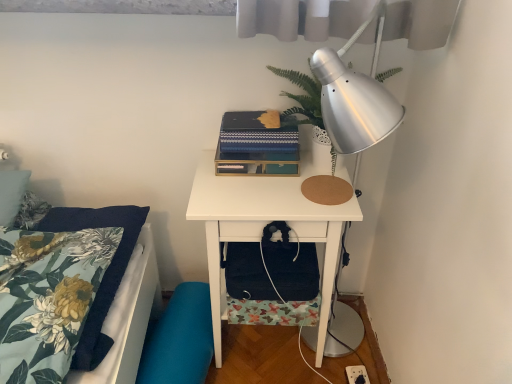
What do you see at coordinates (357, 374) in the screenshot?
I see `white plastic electric outlet at lower right` at bounding box center [357, 374].

Where is `blue textured book at center`? The height and width of the screenshot is (384, 512). blue textured book at center is located at coordinates (256, 133).

Image resolution: width=512 pixels, height=384 pixels. What do you see at coordinates (179, 339) in the screenshot?
I see `teal fabric swivel chair at lower left` at bounding box center [179, 339].

Identify the location of floral fabric pillow at left. The height and width of the screenshot is (384, 512). (117, 323).

Does teal fabric swivel chair at lower left lie in front of black fabric bag at lower center?

No, it is behind black fabric bag at lower center.

Is teal fabric swivel chair at lower left bigger or smaller than black fabric bag at lower center?

Clearly, teal fabric swivel chair at lower left is larger in size than black fabric bag at lower center.

The height and width of the screenshot is (384, 512). I want to click on footrest located on the right of teal fabric swivel chair at lower left, so click(x=293, y=270).

Measure the distance from green leafy plant at upper right to teal fabric swivel chair at lower left.

green leafy plant at upper right and teal fabric swivel chair at lower left are 90.93 centimeters apart from each other.

Considering the sizes of green leafy plant at upper right and teal fabric swivel chair at lower left in the image, is green leafy plant at upper right taller or shorter than teal fabric swivel chair at lower left?

In the image, green leafy plant at upper right appears to be taller than teal fabric swivel chair at lower left.

In the scene shown: From a real-world perspective, which object stands above the other?

green leafy plant at upper right is physically above.

Which is more to the right, green leafy plant at upper right or teal fabric swivel chair at lower left?

From the viewer's perspective, green leafy plant at upper right appears more on the right side.

Is teal fabric swivel chair at lower left far from white matte nightstand at center?

No, teal fabric swivel chair at lower left is in close proximity to white matte nightstand at center.

From the image's perspective, between teal fabric swivel chair at lower left and white matte nightstand at center, which one is located above?

white matte nightstand at center, from the image's perspective.

Does teal fabric swivel chair at lower left contain white matte nightstand at center?

That's incorrect, white matte nightstand at center is not inside teal fabric swivel chair at lower left.

Considering the relative sizes of teal fabric swivel chair at lower left and white matte nightstand at center in the image provided, is teal fabric swivel chair at lower left taller than white matte nightstand at center?

Incorrect, the height of teal fabric swivel chair at lower left is not larger of that of white matte nightstand at center.

From a real-world perspective, which is physically above, blue textured book at center or black fabric bag at lower center?

From a 3D spatial view, blue textured book at center is above.

Does blue textured book at center turn towards black fabric bag at lower center?

No, blue textured book at center is not turned towards black fabric bag at lower center.

Which object is closer to the camera taking this photo, blue textured book at center or black fabric bag at lower center?

black fabric bag at lower center is closer to the camera.

Consider the image. Is blue textured book at center bigger than black fabric bag at lower center?

Actually, blue textured book at center might be smaller than black fabric bag at lower center.

From a real-world perspective, is teal fabric swivel chair at lower left positioned under green leafy plant at upper right based on gravity?

Correct, in the physical world, teal fabric swivel chair at lower left is lower than green leafy plant at upper right.

Consider the image. Considering the relative positions of teal fabric swivel chair at lower left and green leafy plant at upper right in the image provided, is teal fabric swivel chair at lower left to the left or to the right of green leafy plant at upper right?

In the image, teal fabric swivel chair at lower left appears on the left side of green leafy plant at upper right.

In terms of height, does teal fabric swivel chair at lower left look taller or shorter compared to green leafy plant at upper right?

Clearly, teal fabric swivel chair at lower left is shorter compared to green leafy plant at upper right.

Can you tell me how much teal fabric swivel chair at lower left and green leafy plant at upper right differ in facing direction?

The facing directions of teal fabric swivel chair at lower left and green leafy plant at upper right are 83.4 degrees apart.

Considering the sizes of objects teal fabric swivel chair at lower left and blue textured book at center in the image provided, who is taller, teal fabric swivel chair at lower left or blue textured book at center?

Standing taller between the two is teal fabric swivel chair at lower left.

Is teal fabric swivel chair at lower left positioned beyond the bounds of blue textured book at center?

Absolutely, teal fabric swivel chair at lower left is external to blue textured book at center.

Is teal fabric swivel chair at lower left facing away from blue textured book at center?

No, teal fabric swivel chair at lower left is not facing the opposite direction of blue textured book at center.

Measure the distance between teal fabric swivel chair at lower left and blue textured book at center.

teal fabric swivel chair at lower left is 25.45 inches from blue textured book at center.

Is white plastic electric outlet at lower right in front of teal fabric swivel chair at lower left?

No.

From the image's perspective, relative to teal fabric swivel chair at lower left, is white plastic electric outlet at lower right above or below?

From the image's perspective, white plastic electric outlet at lower right appears below teal fabric swivel chair at lower left.

From the picture: Is teal fabric swivel chair at lower left a part of white plastic electric outlet at lower right?

Actually, teal fabric swivel chair at lower left is outside white plastic electric outlet at lower right.

At what (x,y) coordinates should I click in order to perform the action: click on the footrest above the teal fabric swivel chair at lower left (from a real-world perspective). Please return your answer as a coordinate pair (x, y). Looking at the image, I should click on (293, 270).

Locate an element on the screen. swivel chair below the green leafy plant at upper right (from a real-world perspective) is located at coordinates (179, 339).

Looking at the image, which one is located closer to floral fabric pillow at left, black fabric bag at lower center or white matte nightstand at center?

white matte nightstand at center lies closer to floral fabric pillow at left than the other object.

Based on their spatial positions, is blue textured book at center or floral fabric pillow at left further from green leafy plant at upper right?

floral fabric pillow at left is further to green leafy plant at upper right.

Considering their positions, is floral fabric pillow at left positioned further to black fabric bag at lower center than teal fabric swivel chair at lower left?

Based on the image, floral fabric pillow at left appears to be further to black fabric bag at lower center.

From the picture: Estimate the real-world distances between objects in this image. Which object is further from blue textured book at center, white plastic electric outlet at lower right or black fabric bag at lower center?

white plastic electric outlet at lower right.

Consider the image. Based on their spatial positions, is black fabric bag at lower center or green leafy plant at upper right closer to teal fabric swivel chair at lower left?

Among the two, black fabric bag at lower center is located nearer to teal fabric swivel chair at lower left.

Which object lies further to the anchor point black fabric bag at lower center, blue textured book at center or white matte nightstand at center?

blue textured book at center lies further to black fabric bag at lower center than the other object.

Estimate the real-world distances between objects in this image. Which object is closer to blue textured book at center, white plastic electric outlet at lower right or teal fabric swivel chair at lower left?

teal fabric swivel chair at lower left is closer to blue textured book at center.

When comparing their distances from white plastic electric outlet at lower right, does green leafy plant at upper right or floral fabric pillow at left seem further?

green leafy plant at upper right lies further to white plastic electric outlet at lower right than the other object.

This screenshot has height=384, width=512. Find the location of `paperback book situated between floral fabric pillow at left and green leafy plant at upper right from left to right`. paperback book situated between floral fabric pillow at left and green leafy plant at upper right from left to right is located at coordinates (256, 133).

Where is `nightstand between blue textured book at center and teal fabric swivel chair at lower left vertically`? nightstand between blue textured book at center and teal fabric swivel chair at lower left vertically is located at coordinates (265, 224).

This screenshot has height=384, width=512. In order to click on nightstand situated between teal fabric swivel chair at lower left and white plastic electric outlet at lower right from left to right in this screenshot , I will do `click(265, 224)`.

You are a GUI agent. You are given a task and a screenshot of the screen. Output one action in this format:
    pyautogui.click(x=<x>, y=<y>)
    Task: Click on the paperback book that lies between green leafy plant at upper right and white plastic electric outlet at lower right from top to bottom
    
    Given the screenshot: What is the action you would take?
    pyautogui.click(x=256, y=133)